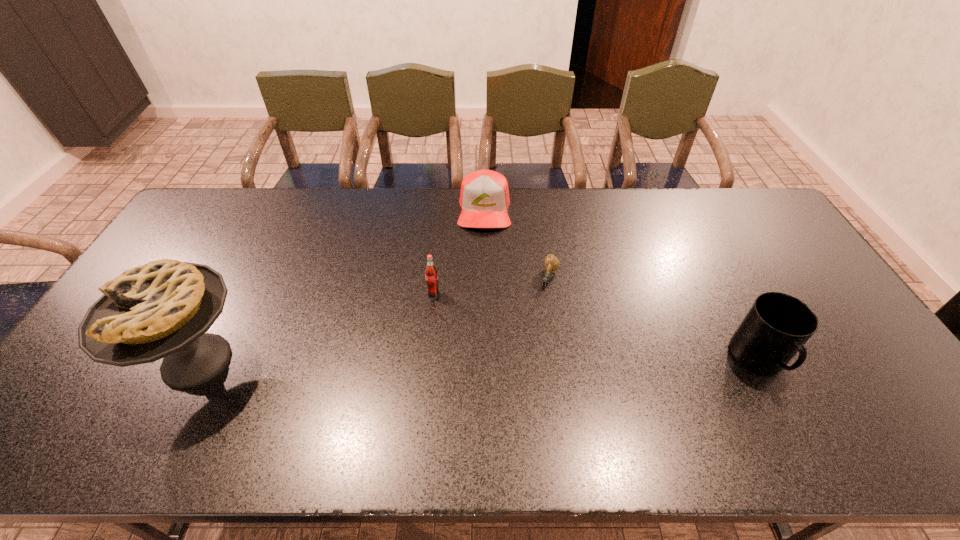
Where is `vacant space located 0.110m on the cut side of the leftmost object`? vacant space located 0.110m on the cut side of the leftmost object is located at coordinates (96, 360).

This screenshot has width=960, height=540. I want to click on vacant space located on the front-facing side of the fourth object from left to right, so click(503, 406).

Locate an element on the screen. vacant space located 0.390m on the front-facing side of the fourth object from left to right is located at coordinates (504, 402).

Identify the location of free region located on the front-facing side of the fourth object from left to right. (518, 366).

The height and width of the screenshot is (540, 960). What are the coordinates of `blank area located 0.120m on the front-facing side of the farthest object` in the screenshot? It's located at (484, 257).

Locate an element on the screen. This screenshot has width=960, height=540. vacant area situated 0.350m on the front-facing side of the farthest object is located at coordinates click(x=484, y=312).

Find the location of a particular element. blank space located 0.170m on the front-facing side of the farthest object is located at coordinates (484, 268).

Locate an element on the screen. The image size is (960, 540). blank space located on the label of the soda bottle is located at coordinates (394, 376).

Where is `vacant region located on the label of the soda bottle`? Image resolution: width=960 pixels, height=540 pixels. vacant region located on the label of the soda bottle is located at coordinates (386, 394).

Where is `free space located 0.080m on the label of the soda bottle`? The height and width of the screenshot is (540, 960). free space located 0.080m on the label of the soda bottle is located at coordinates (421, 320).